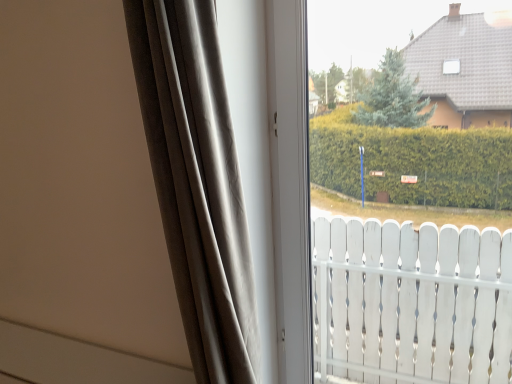
In order to face white picket fence at right, should I rotate leftwards or rightwards?

It's best to rotate right around 17.045 degrees.

Where is `white picket fence at right`? This screenshot has height=384, width=512. white picket fence at right is located at coordinates (416, 302).

This screenshot has height=384, width=512. What do you see at coordinates (416, 302) in the screenshot? I see `white picket fence at right` at bounding box center [416, 302].

In order to click on white picket fence at right in this screenshot , I will do `click(416, 302)`.